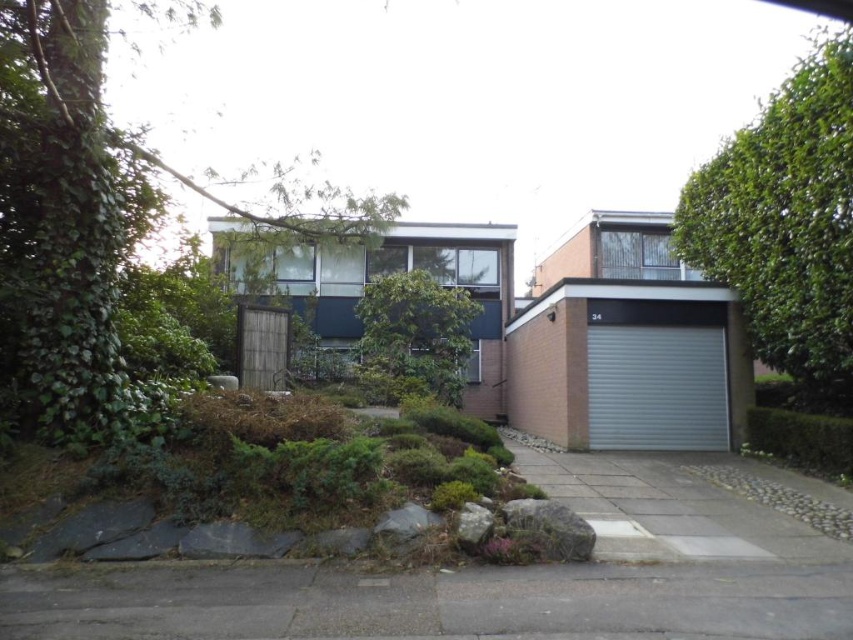
You are a delivery person arriving at this house. You need to park your delivery truck on the gray concrete driveway at lower center. However, the brick garage at center is already closed. Is there enough space on the driveway to park the truck without blocking the garage door?

The gray concrete driveway at lower center is positioned under the brick garage at center, so there might not be enough space to park the truck without blocking the garage door since the driveway is directly beneath it.

You are standing in front of the residential building and notice two points marked on the facade. The first point is at coordinates point (x=569, y=372) and the second is at point (x=630, y=349). Which of these two points is closer to you?

Point (x=569, y=372) is closer to the viewer than point (x=630, y=349).